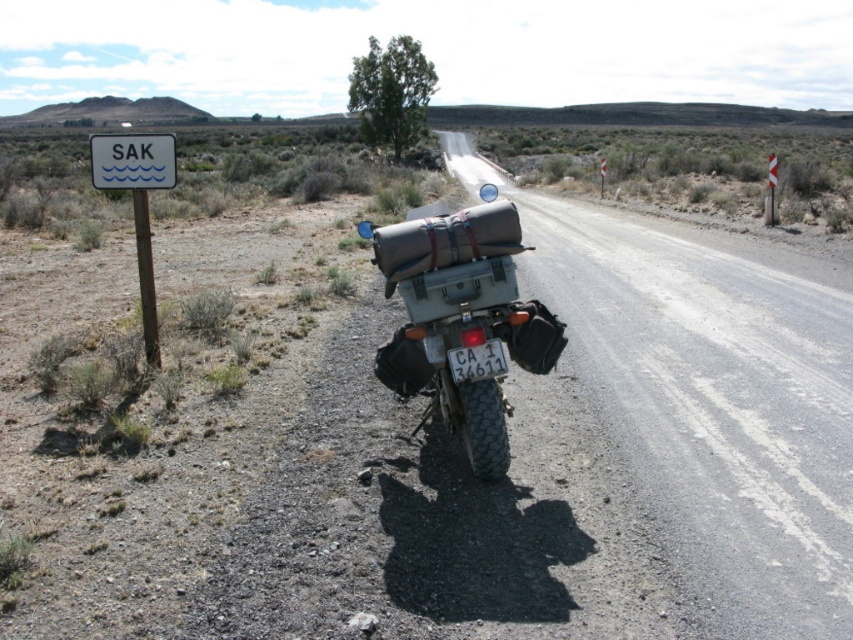
You are standing at the point labeled point (144, 296) and want to walk to the motorcycle parked on the gravel road. Which direction should you go relative to the point labeled point (439, 268)?

You should walk towards the direction of the point labeled point (439, 268) because it is in front of point (144, 296).

You are a traveler who just arrived at this rural roadside spot. You notice the brown leather bag at rear and the white plastic sign at left. Which object is closer to the camera?

The brown leather bag at rear is closer to the camera because it is in front of the white plastic sign at left.

You are a traveler standing next to the motorcycle parked on the gravel road. You need to read the signpost to the left of the motorcycle. Can you see the white plastic sign at left clearly from your current position?

The white plastic sign at left is located at point (137, 204), which is to the left of the motorcycle. Since you are standing next to the motorcycle, you should be able to see the white plastic sign at left clearly from your current position.